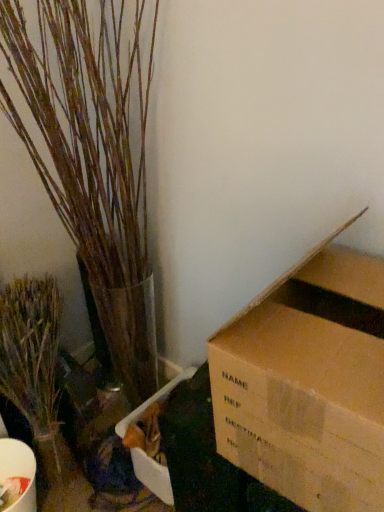
Question: Considering their positions, is bark-like textured plant at left, which is the first houseplant in right-to-left order, located in front of or behind green matte plant at left, acting as the 1th houseplant starting from the left?

Choices:
 (A) front
 (B) behind

Answer: (A)

Question: Is bark-like textured plant at left, the 2th houseplant in the left-to-right sequence, situated inside green matte plant at left, positioned as the 2th houseplant in right-to-left order, or outside?

Choices:
 (A) inside
 (B) outside

Answer: (B)

Question: Is bark-like textured plant at left, which is the first houseplant in right-to-left order, wider or thinner than green matte plant at left, positioned as the 2th houseplant in right-to-left order?

Choices:
 (A) thin
 (B) wide

Answer: (B)

Question: From the image's perspective, relative to bark-like textured plant at left, the 2th houseplant in the left-to-right sequence, is green matte plant at left, acting as the 1th houseplant starting from the left, above or below?

Choices:
 (A) below
 (B) above

Answer: (A)

Question: Relative to bark-like textured plant at left, the 2th houseplant in the left-to-right sequence, is green matte plant at left, acting as the 1th houseplant starting from the left, in front or behind?

Choices:
 (A) front
 (B) behind

Answer: (B)

Question: Do you think green matte plant at left, positioned as the 2th houseplant in right-to-left order, is within bark-like textured plant at left, which is the first houseplant in right-to-left order, or outside of it?

Choices:
 (A) outside
 (B) inside

Answer: (B)

Question: Considering the positions of green matte plant at left, positioned as the 2th houseplant in right-to-left order, and bark-like textured plant at left, the 2th houseplant in the left-to-right sequence, in the image, is green matte plant at left, positioned as the 2th houseplant in right-to-left order, taller or shorter than bark-like textured plant at left, the 2th houseplant in the left-to-right sequence,?

Choices:
 (A) short
 (B) tall

Answer: (A)